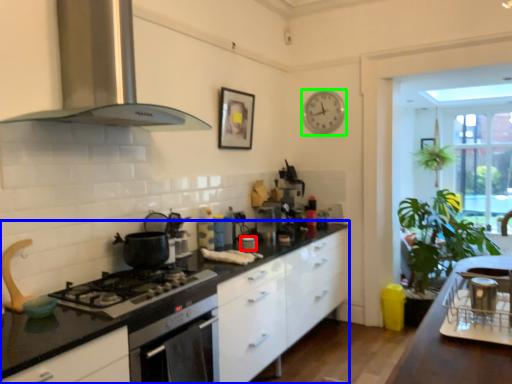
Question: Which is farther away from appliance (highlighted by a red box)? countertop (highlighted by a blue box) or clock (highlighted by a green box)?

Choices:
 (A) countertop
 (B) clock

Answer: (B)